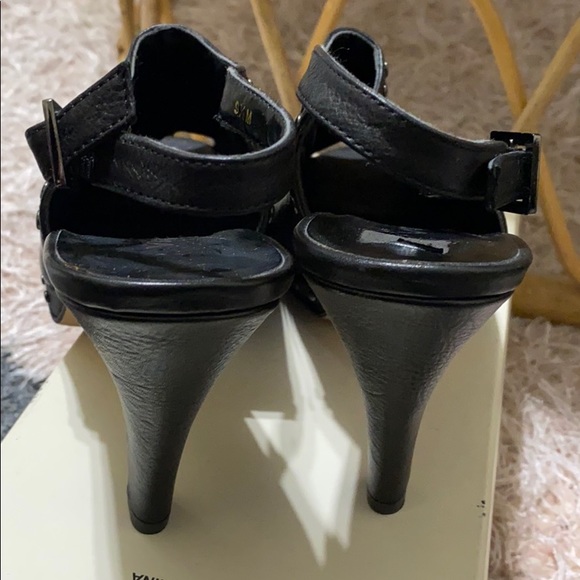
In order to click on shoe box in this screenshot , I will do `click(473, 369)`, `click(443, 508)`, `click(291, 514)`, `click(290, 398)`, `click(298, 437)`, `click(60, 452)`, `click(77, 374)`, `click(84, 542)`, `click(36, 532)`.